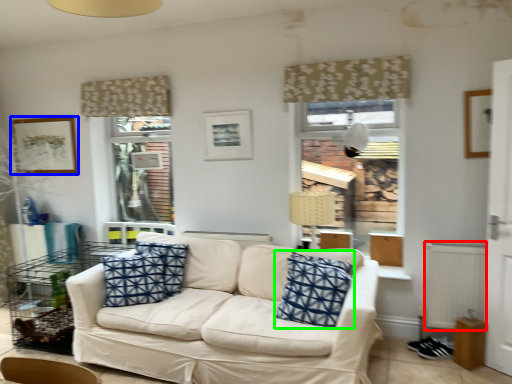
Question: Which object is positioned farthest from radiator (highlighted by a red box)? Select from picture frame (highlighted by a blue box) and pillow (highlighted by a green box).

Choices:
 (A) picture frame
 (B) pillow

Answer: (A)